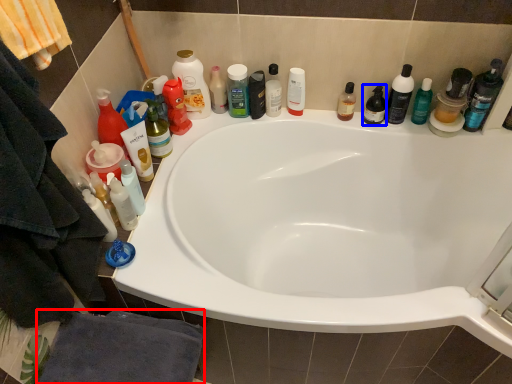
Question: Which object appears farthest to the camera in this image, bath towel (highlighted by a red box) or toiletry (highlighted by a blue box)?

Choices:
 (A) bath towel
 (B) toiletry

Answer: (B)